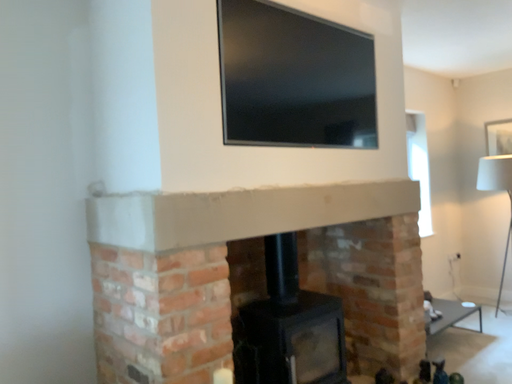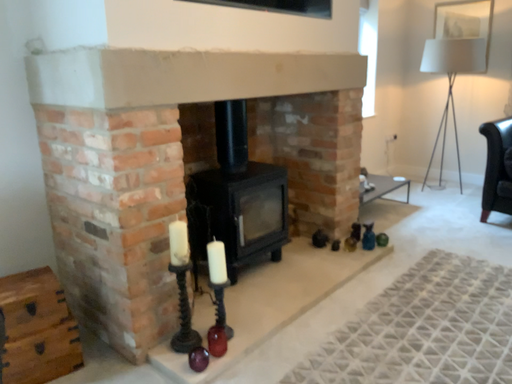
Question: Which way did the camera rotate in the video?

Choices:
 (A) rotated right
 (B) rotated left

Answer: (A)